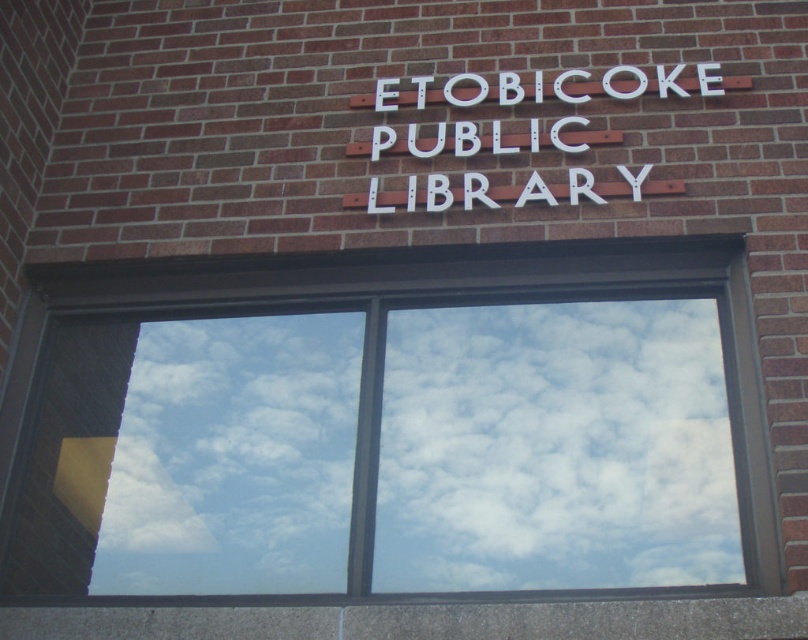
Question: Does transparent glass window at center appear on the left side of white painted wood sign at center?

Choices:
 (A) no
 (B) yes

Answer: (B)

Question: Can you confirm if transparent glass window at center is bigger than white painted wood sign at center?

Choices:
 (A) no
 (B) yes

Answer: (B)

Question: Which of the following is the closest to the observer?

Choices:
 (A) white painted wood sign at center
 (B) transparent glass window at center

Answer: (B)

Question: Which object appears closest to the camera in this image?

Choices:
 (A) white painted wood sign at center
 (B) transparent glass window at center

Answer: (B)

Question: Can you confirm if transparent glass window at center is positioned to the right of white painted wood sign at center?

Choices:
 (A) no
 (B) yes

Answer: (A)

Question: Which point appears farthest from the camera in this image?

Choices:
 (A) [525, 355]
 (B) [537, 145]

Answer: (B)